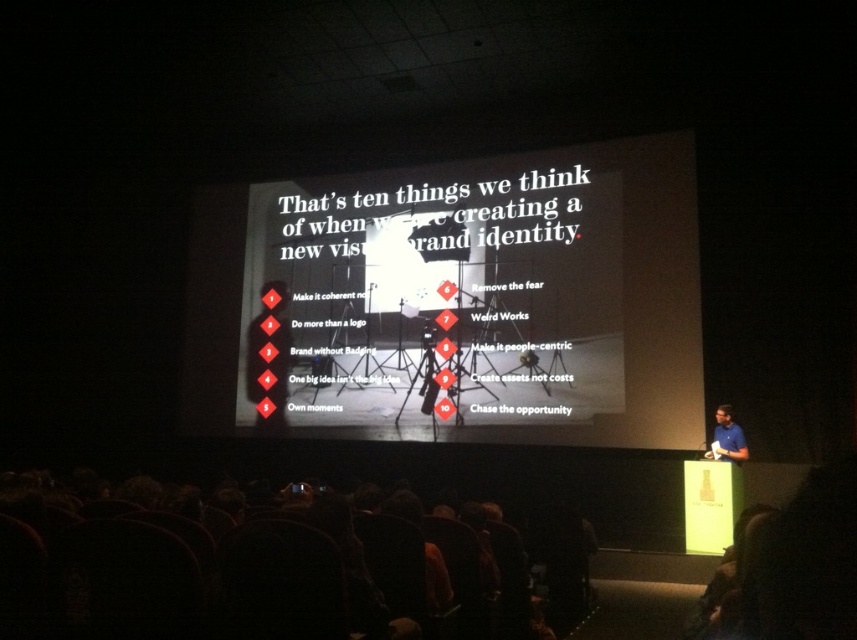
You are an attendee at the presentation and you want to know which object is taller between the white paper at center and the blue shirt at right. Based on the scene description, can you determine which one is taller?

The white paper at center is taller than the blue shirt at right according to the description.

You are organizing a presentation and need to ensure that both the white paper at center and the blue shirt at right are visible to the audience. Considering their sizes, which object might be more easily seen from the back of the room?

The white paper at center has a larger width than the blue shirt at right, so it would be more easily seen from the back of the room due to its greater size.